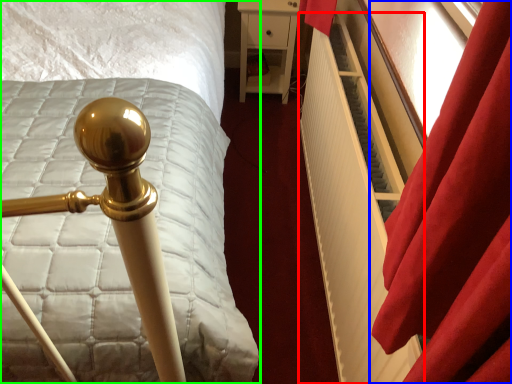
Question: Which object is positioned closest to radiator (highlighted by a red box)? Select from curtain (highlighted by a blue box) and bed (highlighted by a green box).

Choices:
 (A) curtain
 (B) bed

Answer: (A)